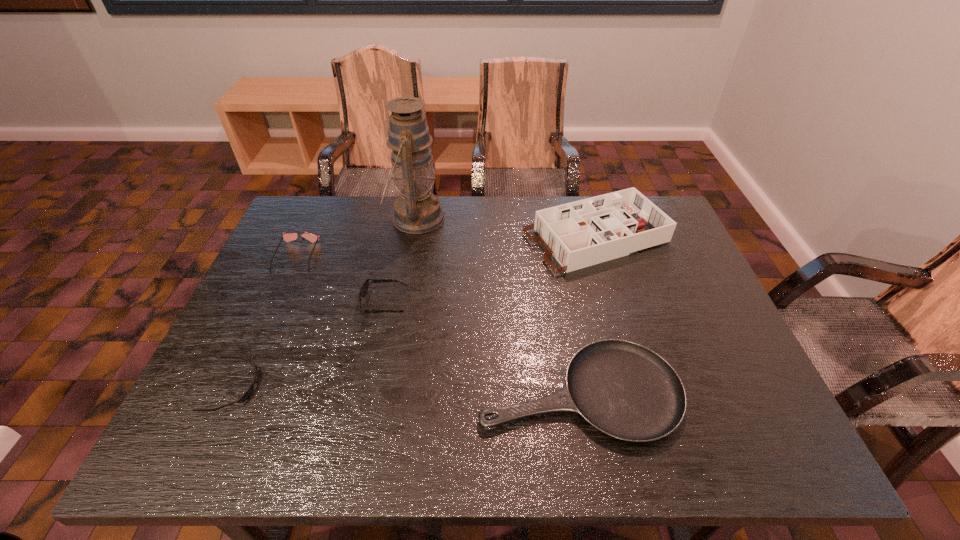
Find the location of a particular element. free space located 0.320m on the front-facing side of the fourth farthest object is located at coordinates (531, 303).

You are a GUI agent. You are given a task and a screenshot of the screen. Output one action in this format:
    pyautogui.click(x=<x>, y=<y>)
    Task: Click on the vacant space situated 0.070m on the back of the frying pan
    The image size is (960, 540).
    Given the screenshot: What is the action you would take?
    pyautogui.click(x=566, y=323)

Where is `vacant region located 0.340m on the front-facing side of the shortest sunglasses`? vacant region located 0.340m on the front-facing side of the shortest sunglasses is located at coordinates (413, 387).

Where is `oil lamp positioned at the far edge`? oil lamp positioned at the far edge is located at coordinates (417, 211).

The image size is (960, 540). Identify the location of dollhouse present at the far edge. (583, 233).

Image resolution: width=960 pixels, height=540 pixels. In order to click on sunglasses situated at the far edge in this screenshot , I will do `click(287, 237)`.

The height and width of the screenshot is (540, 960). What are the coordinates of `object situated at the near edge` in the screenshot? It's located at (625, 390).

At what (x,y) coordinates should I click in order to perform the action: click on object situated at the right edge. Please return your answer as a coordinate pair (x, y). Image resolution: width=960 pixels, height=540 pixels. Looking at the image, I should click on (583, 233).

Find the location of a particular element. object present at the far left corner is located at coordinates (287, 237).

Image resolution: width=960 pixels, height=540 pixels. Find the location of `object that is at the far right corner`. object that is at the far right corner is located at coordinates (583, 233).